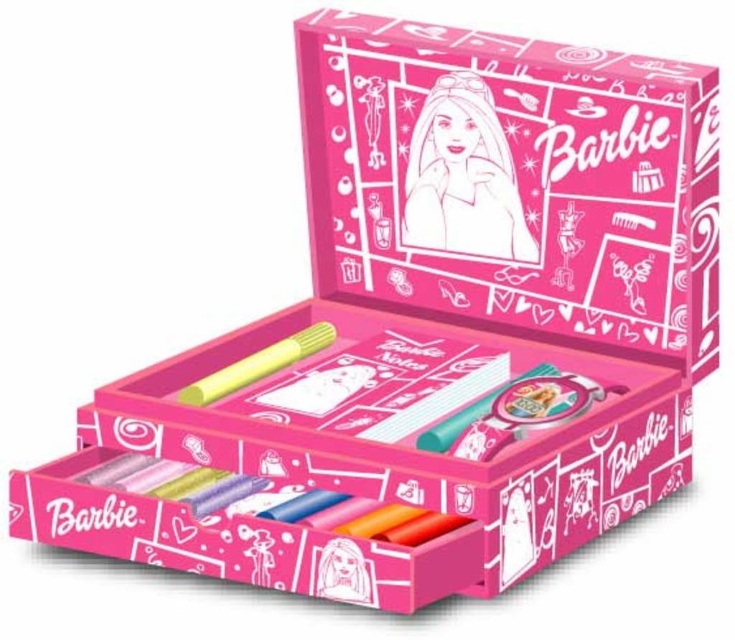
You are holding a Barbie doll and want to place it on a shelf that can only hold items within 30 inches. Can you safely place the pink paper doll at center on the shelf?

The pink paper doll at center is 33.24 inches away from the camera, which exceeds the shelf limit of 30 inches. Therefore, it cannot be placed safely on the shelf.

You are looking at the Barbie stationery set box. Where is the pink paper doll at center located in terms of coordinates?

The pink paper doll at center is located at coordinates point (x=462, y=177).